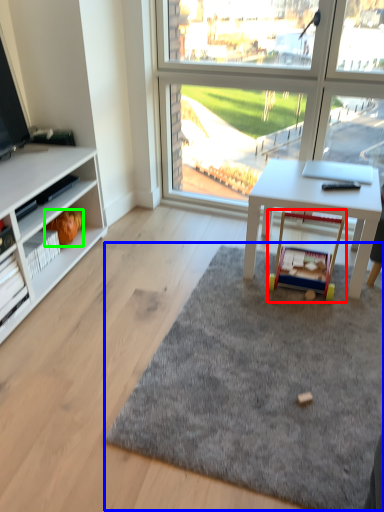
Question: Estimate the real-world distances between objects in this image. Which object is farther from toy (highlighted by a red box), mat (highlighted by a blue box) or toy (highlighted by a green box)?

Choices:
 (A) mat
 (B) toy

Answer: (B)